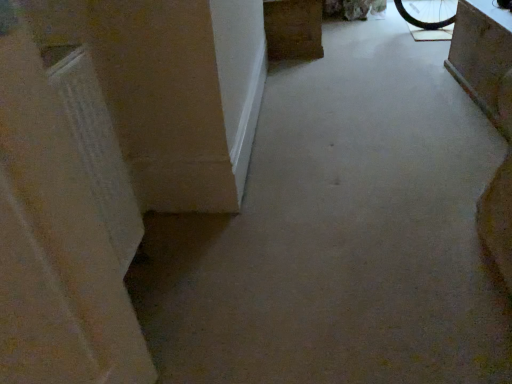
Question: Should I look upward or downward to see brown wood cabinet at upper center, which is the second furniture in front-to-back order?

Choices:
 (A) up
 (B) down

Answer: (A)

Question: Does concrete block at upper right, the 2th furniture in the top-to-bottom sequence, lie in front of brown wood cabinet at upper center, acting as the second furniture starting from the right?

Choices:
 (A) yes
 (B) no

Answer: (A)

Question: Considering the relative sizes of concrete block at upper right, the second furniture in the back-to-front sequence, and brown wood cabinet at upper center, which is counted as the 2th furniture, starting from the bottom, in the image provided, is concrete block at upper right, the second furniture in the back-to-front sequence, shorter than brown wood cabinet at upper center, which is counted as the 2th furniture, starting from the bottom,?

Choices:
 (A) no
 (B) yes

Answer: (A)

Question: Can you confirm if concrete block at upper right, which ranks as the first furniture in front-to-back order, is smaller than brown wood cabinet at upper center, acting as the 1th furniture starting from the top?

Choices:
 (A) no
 (B) yes

Answer: (B)

Question: Considering the relative positions of concrete block at upper right, the 2th furniture in the top-to-bottom sequence, and brown wood cabinet at upper center, which is the second furniture in front-to-back order, in the image provided, is concrete block at upper right, the 2th furniture in the top-to-bottom sequence, to the left of brown wood cabinet at upper center, which is the second furniture in front-to-back order, from the viewer's perspective?

Choices:
 (A) no
 (B) yes

Answer: (A)

Question: Is concrete block at upper right, the 1th furniture positioned from the right, oriented away from brown wood cabinet at upper center, acting as the second furniture starting from the right?

Choices:
 (A) yes
 (B) no

Answer: (B)

Question: Considering the relative sizes of concrete block at upper right, the 1th furniture in the bottom-to-top sequence, and brown wood cabinet at upper center, which is counted as the 2th furniture, starting from the bottom, in the image provided, is concrete block at upper right, the 1th furniture in the bottom-to-top sequence, wider than brown wood cabinet at upper center, which is counted as the 2th furniture, starting from the bottom,?

Choices:
 (A) no
 (B) yes

Answer: (A)

Question: Is concrete block at upper right, the 1th furniture in the bottom-to-top sequence, at the back of brown wood cabinet at upper center, which is the second furniture in front-to-back order?

Choices:
 (A) no
 (B) yes

Answer: (A)

Question: From a real-world perspective, is brown wood cabinet at upper center, arranged as the first furniture when viewed from the back, positioned over concrete block at upper right, the second furniture in the back-to-front sequence, based on gravity?

Choices:
 (A) no
 (B) yes

Answer: (A)

Question: Is brown wood cabinet at upper center, which is the second furniture in front-to-back order, facing towards concrete block at upper right, the 1th furniture in the bottom-to-top sequence?

Choices:
 (A) yes
 (B) no

Answer: (B)

Question: Can you confirm if brown wood cabinet at upper center, arranged as the first furniture when viewed from the back, is wider than concrete block at upper right, the 2th furniture in the top-to-bottom sequence?

Choices:
 (A) no
 (B) yes

Answer: (B)

Question: Would you say brown wood cabinet at upper center, which is the second furniture in front-to-back order, contains concrete block at upper right, the 1th furniture positioned from the right?

Choices:
 (A) no
 (B) yes

Answer: (A)

Question: Considering the relative positions of brown wood cabinet at upper center, which is the second furniture in front-to-back order, and concrete block at upper right, the 1th furniture in the bottom-to-top sequence, in the image provided, is brown wood cabinet at upper center, which is the second furniture in front-to-back order, to the right of concrete block at upper right, the 1th furniture in the bottom-to-top sequence, from the viewer's perspective?

Choices:
 (A) yes
 (B) no

Answer: (B)

Question: Considering the positions of brown wood cabinet at upper center, which is the second furniture in front-to-back order, and concrete block at upper right, which ranks as the first furniture in front-to-back order, in the image, is brown wood cabinet at upper center, which is the second furniture in front-to-back order, taller or shorter than concrete block at upper right, which ranks as the first furniture in front-to-back order,?

Choices:
 (A) tall
 (B) short

Answer: (B)